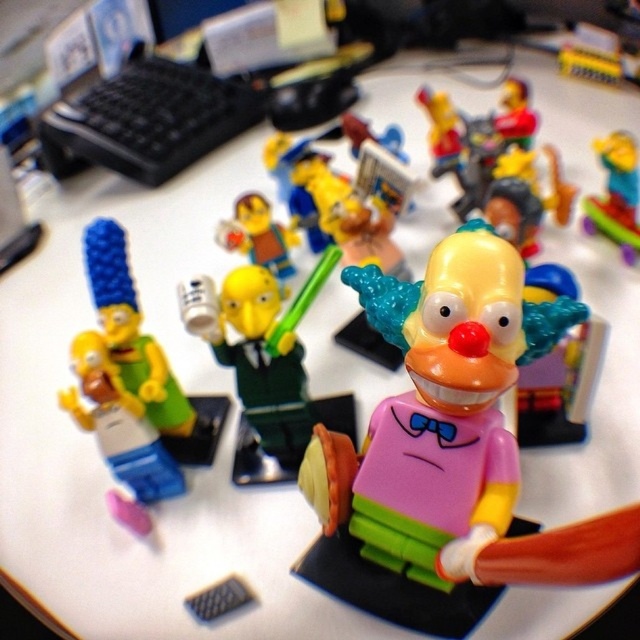
From the picture: Between green plastic mug at center and translucent yellow clown at center, which one has more height?

green plastic mug at center is taller.

Based on the photo, is green plastic mug at center smaller than translucent yellow clown at center?

No, green plastic mug at center is not smaller than translucent yellow clown at center.

Between point (259, 296) and point (584, 202), which one is positioned behind?

Positioned behind is point (584, 202).

In order to click on green plastic mug at center in this screenshot , I will do `click(260, 349)`.

Is point (436, 374) in front of point (618, 152)?

Yes, it is in front of point (618, 152).

Between point (392, 420) and point (628, 177), which one is positioned behind?

The point (628, 177) is behind.

Where is `pink matte clown at center`? The image size is (640, 640). pink matte clown at center is located at coordinates (436, 404).

Who is more distant from viewer, (x=371, y=291) or (x=227, y=250)?

The point (x=227, y=250) is more distant.

Does pink matte clown at center have a lesser height compared to translucent yellow figure at center?

In fact, pink matte clown at center may be taller than translucent yellow figure at center.

Between point (452, 257) and point (257, 234), which one is positioned behind?

Point (257, 234)

Find the location of a particular element. pink matte clown at center is located at coordinates (436, 404).